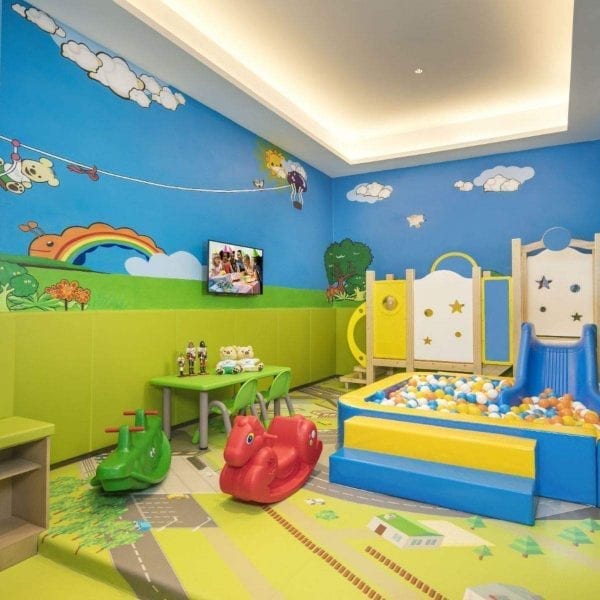
I want to click on red rockinghorse, so click(x=268, y=456).